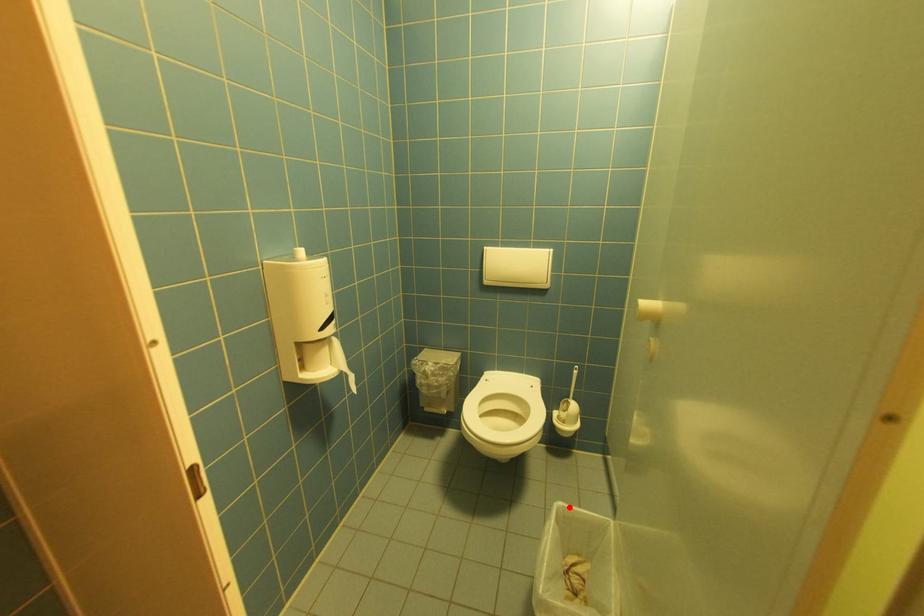
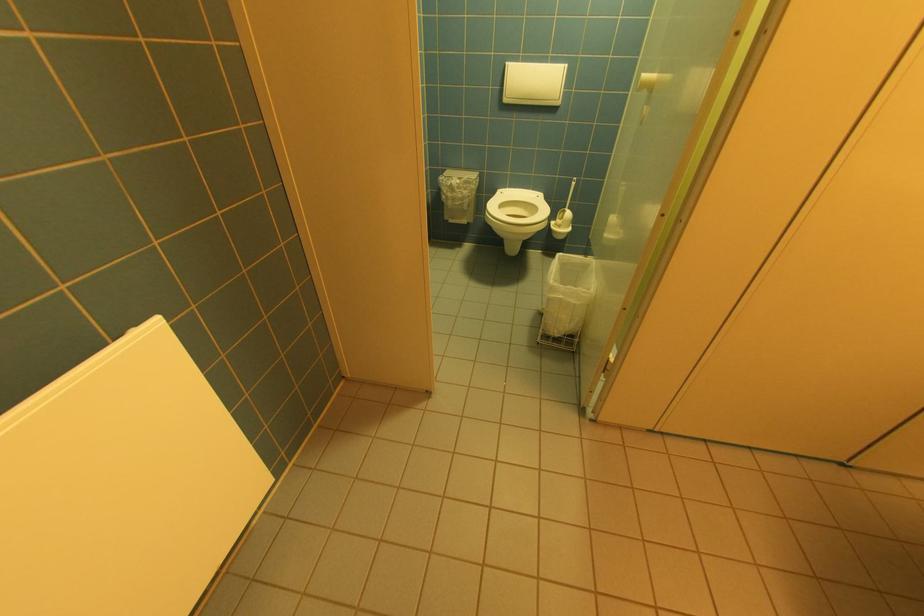
Question: I am providing you with two images of the same scene from different viewpoints. Image1 has a red point marked. In image2, the corresponding 3D location appears at what relative position? Reply with the corresponding letter.

Choices:
 (A) Closer
 (B) Farther

Answer: (A)